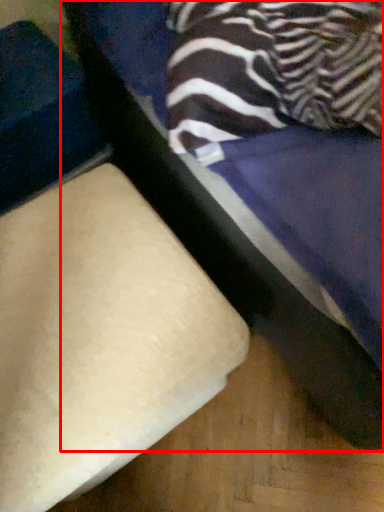
Question: From the image's perspective, where is furniture (annotated by the red box) located in relation to furniture in the image?

Choices:
 (A) above
 (B) below

Answer: (A)